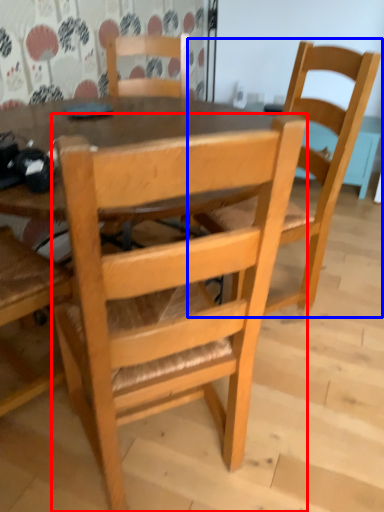
Question: Which object is further to the camera taking this photo, chair (highlighted by a red box) or chair (highlighted by a blue box)?

Choices:
 (A) chair
 (B) chair

Answer: (B)